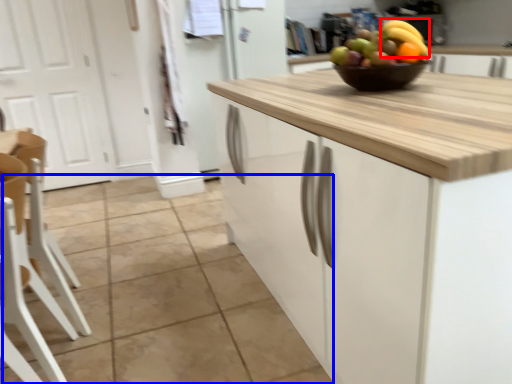
Question: Among these objects, which one is farthest to the camera, banana (highlighted by a red box) or tile (highlighted by a blue box)?

Choices:
 (A) banana
 (B) tile

Answer: (A)